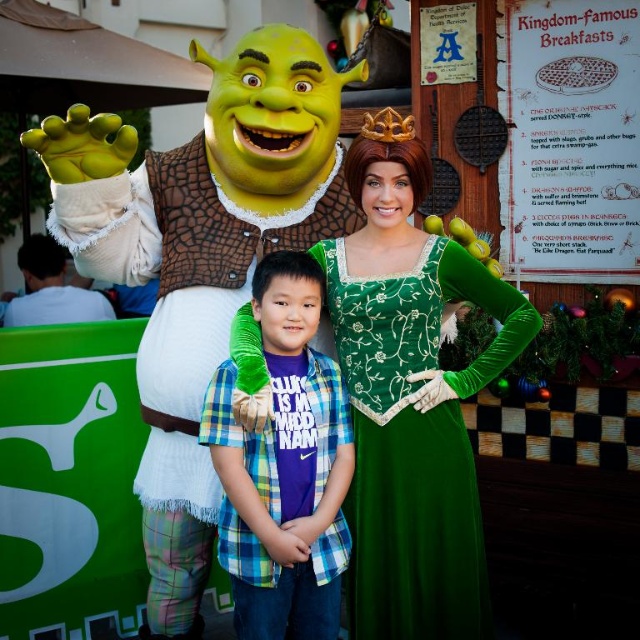
In the scene from the Shrek characters photo, there are a matte green costume at left and a plaid shirt at center. Which character is taller?

The matte green costume at left is much taller than the plaid shirt at center.

In the scene from the Shrek characters photo, there is a matte green costume at left and a velvet green dress at center. Which of these two items is positioned higher up in the image?

The matte green costume at left is located above the velvet green dress at center, so it is positioned higher up in the image.

You are a costume designer preparing for a play. You have two costumes to fit on a mannequin stand that can only hold items with a maximum size of 1.2 meters. The velvet green dress at center and plaid shirt at center are both needed. Based on their sizes, which costume will fit on the stand and which might require a larger stand?

The velvet green dress at center has a larger size compared to plaid shirt at center. Therefore, the plaid shirt at center will fit on the mannequin stand, while the velvet green dress at center might require a larger stand due to its bigger size.